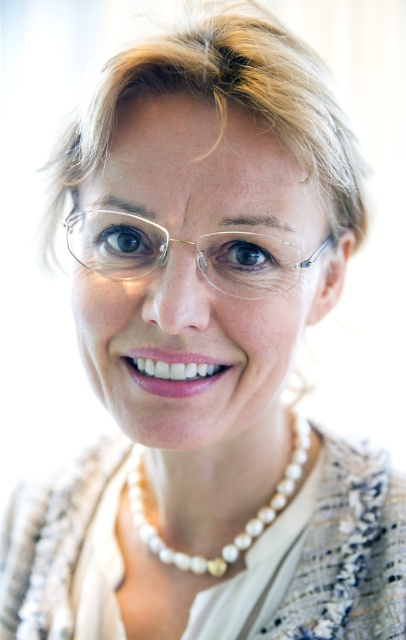
You are a photographer adjusting the focus on your camera. You want to capture both the pearl necklace at center and the brown glossy eye at center in sharp detail. Given that your camera can focus sharply on objects within a 10 inch range, will both items be in focus?

The distance between the pearl necklace at center and the brown glossy eye at center is 9.90 inches, which is within the camera focus range of 10 inches. Therefore, both items will be in focus.

You are a photographer adjusting the focus on your camera. You notice the clear plastic glasses at center and the brown glossy eye at center in your viewfinder. Which object should you focus on first if you want to ensure both are in sharp focus, considering their size in the frame?

The clear plastic glasses at center is taller than the brown glossy eye at center, so focusing on the larger clear plastic glasses at center first would help ensure both are in focus as it occupies more space in the frame.